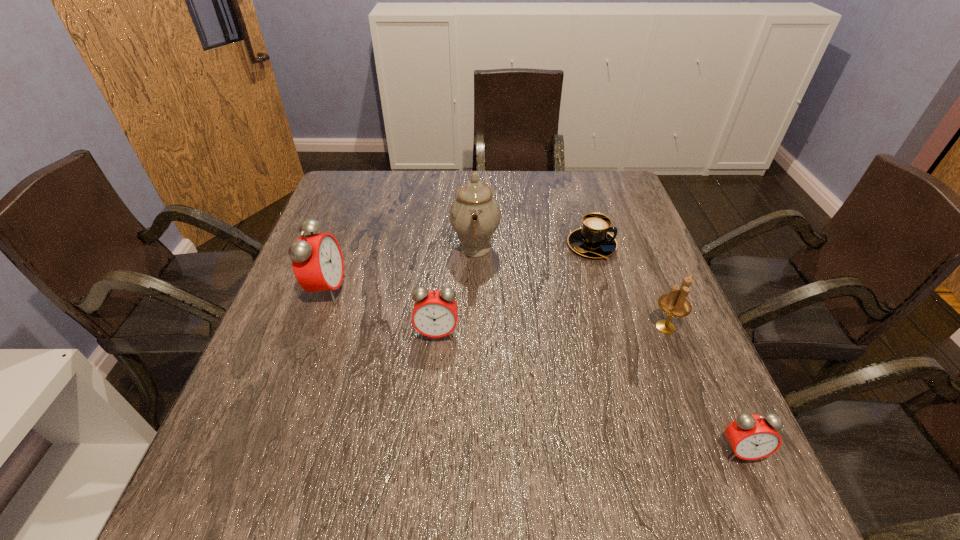
Locate an element on the screen. Image resolution: width=960 pixels, height=540 pixels. empty space between the candle holder and the fifth tallest object is located at coordinates (703, 389).

Locate an element on the screen. unoccupied area between the fourth object from left to right and the shortest alarm clock is located at coordinates (666, 348).

Identify the location of free point between the shortest alarm clock and the leftmost alarm clock. (534, 370).

You are a GUI agent. You are given a task and a screenshot of the screen. Output one action in this format:
    pyautogui.click(x=<x>, y=<y>)
    Task: Click on the free space between the fourth object from left to right and the second alarm clock from left to right
    This screenshot has width=960, height=540.
    Given the screenshot: What is the action you would take?
    pyautogui.click(x=515, y=289)

This screenshot has width=960, height=540. Identify the location of vacant point located between the tallest object and the leftmost object. (401, 268).

Where is `free spot between the farthest alarm clock and the rightmost alarm clock`? free spot between the farthest alarm clock and the rightmost alarm clock is located at coordinates coord(534,370).

I want to click on free area in between the chinaware and the cappuccino, so click(534, 246).

Locate which object is the fifth closest to the candle holder. Please provide its 2D coordinates. Your answer should be formatted as a tuple, i.e. [(x, y)], where the tuple contains the x and y coordinates of a point satisfying the conditions above.

[(317, 261)]

This screenshot has width=960, height=540. In order to click on object that is the fourth closest to the leftmost object in this screenshot , I will do `click(675, 304)`.

Identify the location of alarm clock that stands as the second closest to the tallest alarm clock. (751, 437).